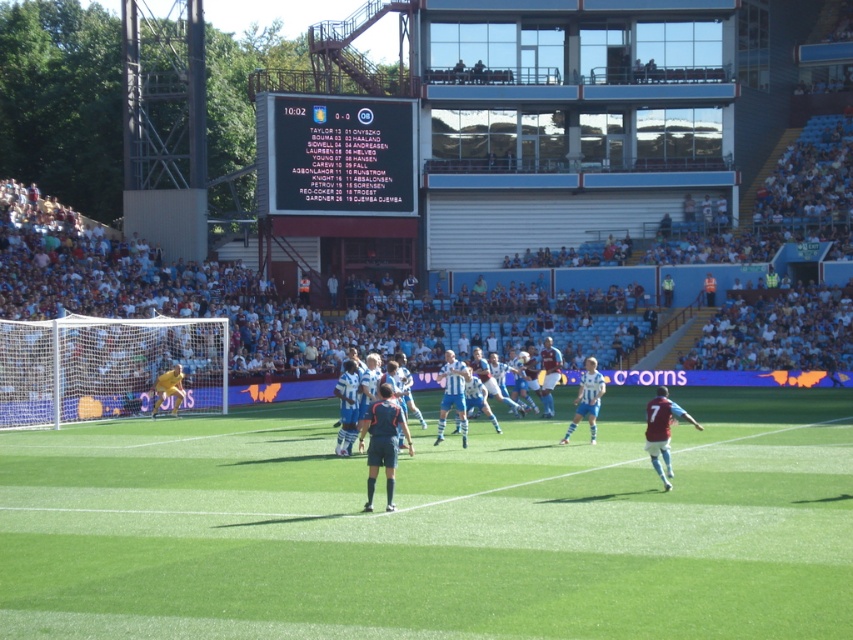
Between green grass field at center and dark blue uniform at center, which one has more height?

With more height is dark blue uniform at center.

Between green grass field at center and dark blue uniform at center, which one is positioned higher?

dark blue uniform at center is above.

Which is behind, point (674, 394) or point (386, 390)?

The point (674, 394) is behind.

The image size is (853, 640). In order to click on green grass field at center in this screenshot , I will do `click(434, 528)`.

Based on the photo, between dark blue uniform at center and yellow jersey at left, which one is positioned higher?

yellow jersey at left

Which of these two, dark blue uniform at center or yellow jersey at left, stands taller?

yellow jersey at left

The image size is (853, 640). What are the coordinates of `dark blue uniform at center` in the screenshot? It's located at (381, 442).

Which is below, black plastic scoreboard at upper center or maroon jersey at center?

maroon jersey at center is lower down.

Which is behind, point (264, 192) or point (650, 440)?

Positioned behind is point (264, 192).

Locate an element on the screen. The height and width of the screenshot is (640, 853). black plastic scoreboard at upper center is located at coordinates (335, 156).